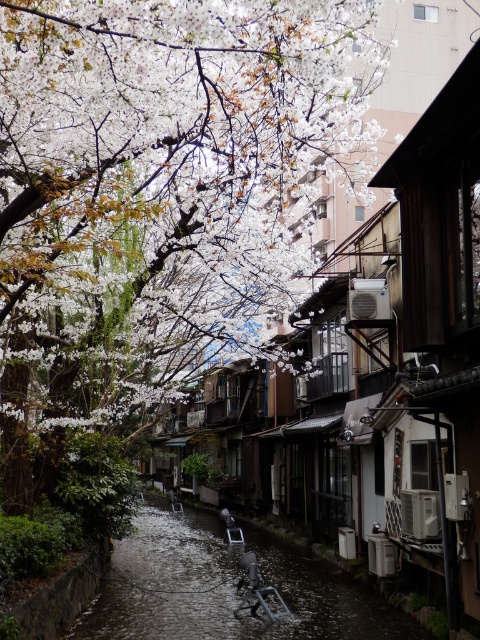
You are a photographer standing at the edge of the canal. You want to capture a photo where the white blossoms at upper center and dark gray concrete river at center are both visible. Based on their heights, which object will appear larger in the photo?

The white blossoms at upper center will appear larger in the photo because they have a greater height compared to the dark gray concrete river at center.

You are standing on the canal side and want to take a photo of the white blossoms at upper center. If your camera has a maximum focus range of 30 feet, will you need to move closer to capture it clearly?

The white blossoms at upper center are 31.02 feet away from the viewer. Since the camera can only focus up to 30 feet, you need to move closer to ensure the white blossoms at upper center are within the camera range.

You are a photographer planning to capture the entire scene in one shot. Given that your camera has a limited field of view, which object between the white blossoms at upper center and the dark gray concrete river at center would require you to adjust your framing to ensure both are fully visible?

The white blossoms at upper center might be wider than the dark gray concrete river at center, so you may need to adjust your framing to accommodate their width to ensure both are fully visible.